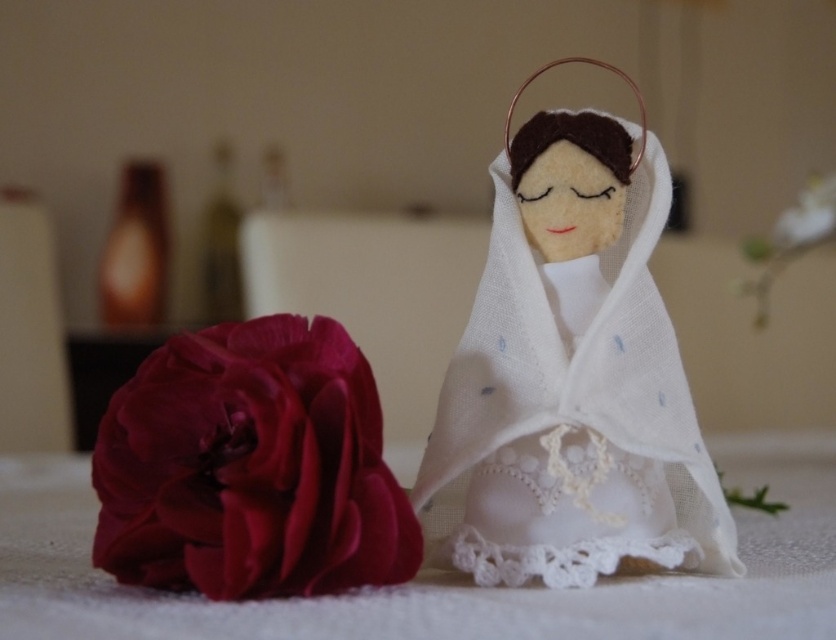
Between white felt/linen robe at center and matte silk rose at lower left, which one is positioned lower?

Positioned lower is matte silk rose at lower left.

Describe the element at coordinates (574, 378) in the screenshot. The image size is (836, 640). I see `white felt/linen robe at center` at that location.

You are a GUI agent. You are given a task and a screenshot of the screen. Output one action in this format:
    pyautogui.click(x=<x>, y=<y>)
    Task: Click on the white felt/linen robe at center
    This screenshot has width=836, height=640.
    Given the screenshot: What is the action you would take?
    pyautogui.click(x=574, y=378)